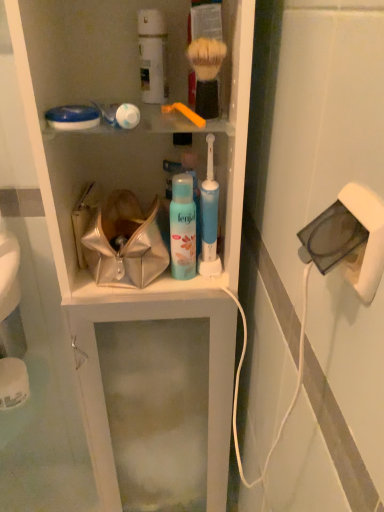
Question: Considering the positions of white matte canister at upper center, which is counted as the second toiletry, starting from the bottom, and soft bristle shaving brush at upper center, which is the 1th brush from right to left, in the image, is white matte canister at upper center, which is counted as the second toiletry, starting from the bottom, wider or thinner than soft bristle shaving brush at upper center, which is the 1th brush from right to left,?

Choices:
 (A) wide
 (B) thin

Answer: (A)

Question: From the image's perspective, is white matte canister at upper center, which appears as the 1th toiletry when viewed from the left, above or below soft bristle shaving brush at upper center, which is the 1th brush from right to left?

Choices:
 (A) below
 (B) above

Answer: (B)

Question: Which of these objects is positioned farthest from the metallic shiny handbag at center?

Choices:
 (A) white plastic cabinet at center
 (B) white matte canister at upper center, positioned as the first toiletry in top-to-bottom order
 (C) blue plastic toothbrush at center, the first toiletry when ordered from bottom to top
 (D) blue matte bottle at center
 (E) white plastic electric outlet at right

Answer: (E)

Question: Based on their relative distances, which object is nearer to the metallic shiny handbag at center?

Choices:
 (A) white plastic cabinet at center
 (B) white plastic electric outlet at right
 (C) blue matte bottle at center
 (D) yellow plastic toothbrush at upper center, the 2th brush in the right-to-left sequence
 (E) soft bristle shaving brush at upper center, marked as the second brush in a left-to-right arrangement

Answer: (C)